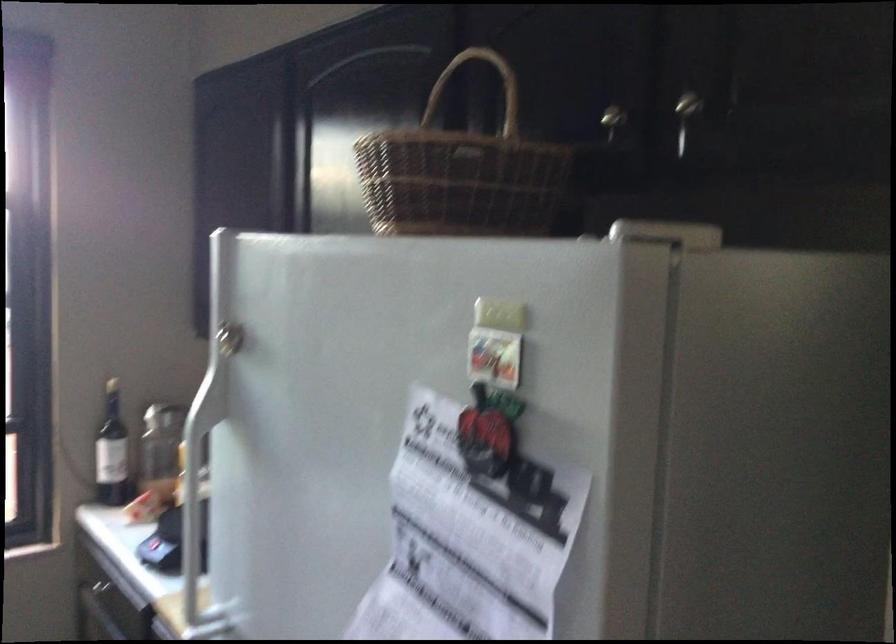
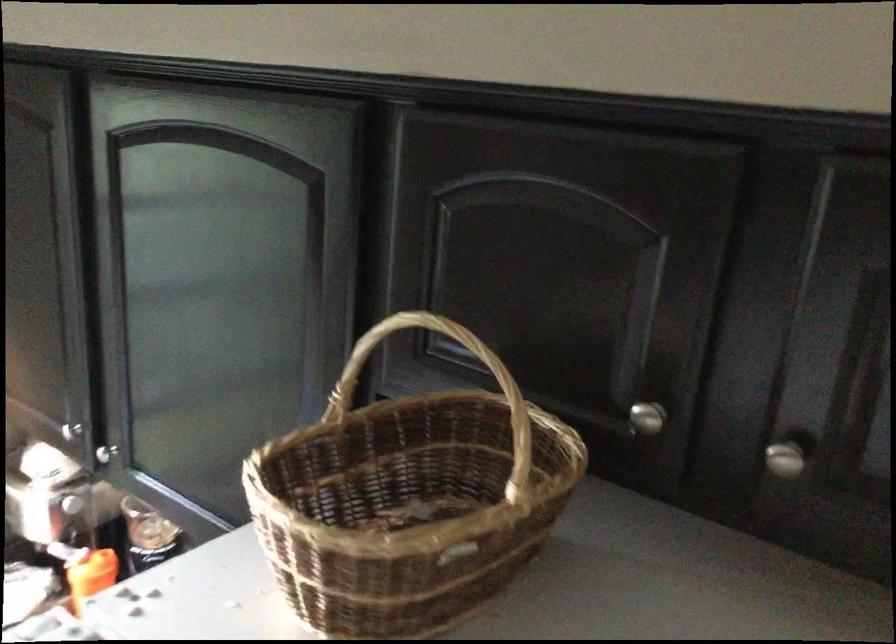
Question: How did the camera likely rotate?

Choices:
 (A) Left
 (B) Right
 (C) Up
 (D) Down

Answer: (B)